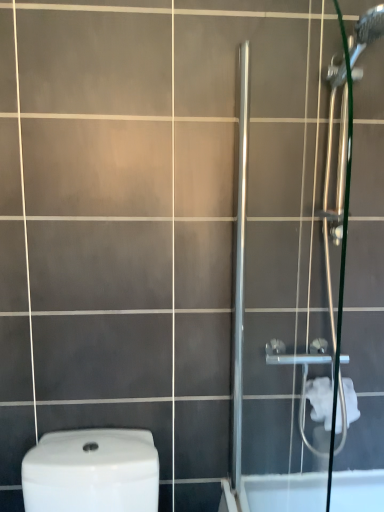
Question: Considering the relative positions of satin chrome shower door at right and white soft toilet paper at right in the image provided, is satin chrome shower door at right to the left of white soft toilet paper at right from the viewer's perspective?

Choices:
 (A) yes
 (B) no

Answer: (A)

Question: Is white soft toilet paper at right completely or partially inside satin chrome shower door at right?

Choices:
 (A) no
 (B) yes

Answer: (A)

Question: From a real-world perspective, is satin chrome shower door at right located higher than white soft toilet paper at right?

Choices:
 (A) no
 (B) yes

Answer: (B)

Question: Is satin chrome shower door at right smaller than white soft toilet paper at right?

Choices:
 (A) yes
 (B) no

Answer: (B)

Question: Considering the relative sizes of satin chrome shower door at right and white soft toilet paper at right in the image provided, is satin chrome shower door at right thinner than white soft toilet paper at right?

Choices:
 (A) no
 (B) yes

Answer: (B)

Question: From a real-world perspective, is satin chrome shower door at right below white soft toilet paper at right?

Choices:
 (A) no
 (B) yes

Answer: (A)

Question: Is white soft toilet paper at right turned away from satin chrome shower door at right?

Choices:
 (A) no
 (B) yes

Answer: (A)

Question: From a real-world perspective, is white soft toilet paper at right on satin chrome shower door at right?

Choices:
 (A) no
 (B) yes

Answer: (A)

Question: From the image's perspective, does white soft toilet paper at right appear higher than satin chrome shower door at right?

Choices:
 (A) no
 (B) yes

Answer: (A)

Question: Does white soft toilet paper at right turn towards satin chrome shower door at right?

Choices:
 (A) yes
 (B) no

Answer: (B)

Question: Does white soft toilet paper at right have a greater height compared to satin chrome shower door at right?

Choices:
 (A) no
 (B) yes

Answer: (A)

Question: Is white soft toilet paper at right further to the viewer compared to satin chrome shower door at right?

Choices:
 (A) no
 (B) yes

Answer: (B)

Question: Visually, is white soft toilet paper at right positioned to the left or to the right of satin chrome shower door at right?

Choices:
 (A) right
 (B) left

Answer: (A)